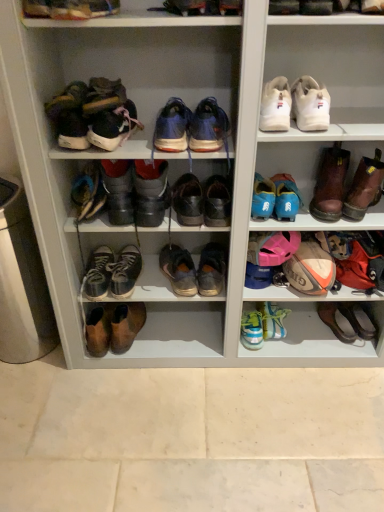
Image resolution: width=384 pixels, height=512 pixels. Find the location of `vacant space underneath leather shoes at center, which appears as the 7th footwear when viewed from the right (from a real-world perspective)`. vacant space underneath leather shoes at center, which appears as the 7th footwear when viewed from the right (from a real-world perspective) is located at coordinates (167, 343).